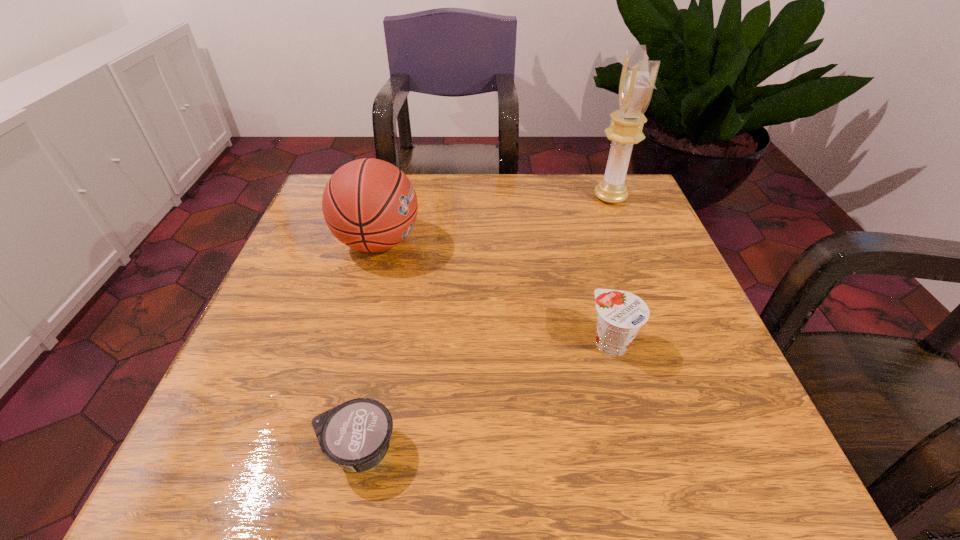
At what (x,y) coordinates should I click in order to perform the action: click on vacant region that satisfies the following two spatial constraints: 1. on the front-facing side of the farthest object; 2. on the front side of the nearest object. Please return your answer as a coordinate pair (x, y). The width and height of the screenshot is (960, 540). Looking at the image, I should click on [708, 449].

The height and width of the screenshot is (540, 960). Identify the location of vacant area that satisfies the following two spatial constraints: 1. on the back side of the third object from left to right; 2. on the logo side of the basketball. (584, 242).

The width and height of the screenshot is (960, 540). What are the coordinates of `free spot that satisfies the following two spatial constraints: 1. on the back side of the farther yogurt; 2. on the logo side of the third nearest object` in the screenshot? It's located at (584, 242).

Where is `free region that satisfies the following two spatial constraints: 1. on the logo side of the second tallest object; 2. on the right side of the nearest object`? The width and height of the screenshot is (960, 540). free region that satisfies the following two spatial constraints: 1. on the logo side of the second tallest object; 2. on the right side of the nearest object is located at coordinates (323, 449).

Identify the location of free space in the image that satisfies the following two spatial constraints: 1. on the back side of the left yogurt; 2. on the left side of the third farthest object. Image resolution: width=960 pixels, height=540 pixels. (380, 343).

Identify the location of vacant space that satisfies the following two spatial constraints: 1. on the front-facing side of the tallest object; 2. on the front side of the farther yogurt. (667, 343).